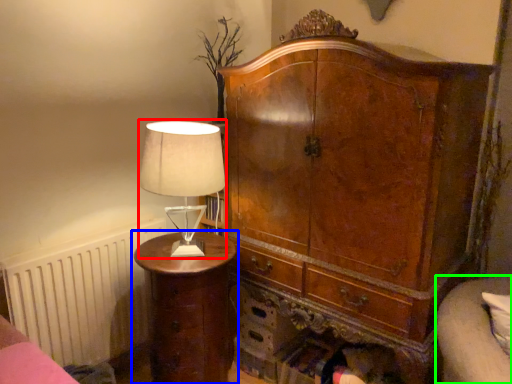
Question: Which object is positioned farthest from table lamp (highlighted by a red box)? Select from nightstand (highlighted by a blue box) and couch (highlighted by a green box).

Choices:
 (A) nightstand
 (B) couch

Answer: (B)